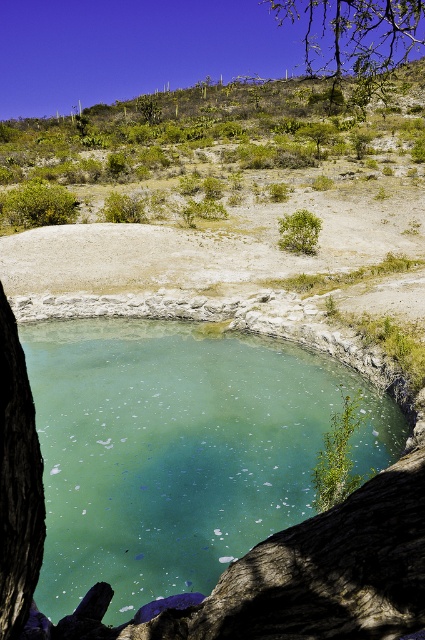
Question: Observing the image, what is the correct spatial positioning of green translucent water at center in reference to green leafy tree at upper right?

Choices:
 (A) right
 (B) left

Answer: (B)

Question: Which point is closer to the camera?

Choices:
 (A) dark brown textured tree trunk at left
 (B) green translucent water at center
 (C) green leafy bush at center
 (D) green leafy tree at upper right

Answer: (A)

Question: Among these objects, which one is farthest from the camera?

Choices:
 (A) green leafy tree at upper right
 (B) dark brown textured tree trunk at left

Answer: (A)

Question: Is green translucent water at center positioned in front of green leafy bush at center?

Choices:
 (A) yes
 (B) no

Answer: (A)

Question: From the image, what is the correct spatial relationship of green translucent water at center in relation to green leafy tree at upper right?

Choices:
 (A) right
 (B) left

Answer: (B)

Question: Which of the following is the closest to the observer?

Choices:
 (A) (13, 579)
 (B) (272, 468)

Answer: (A)